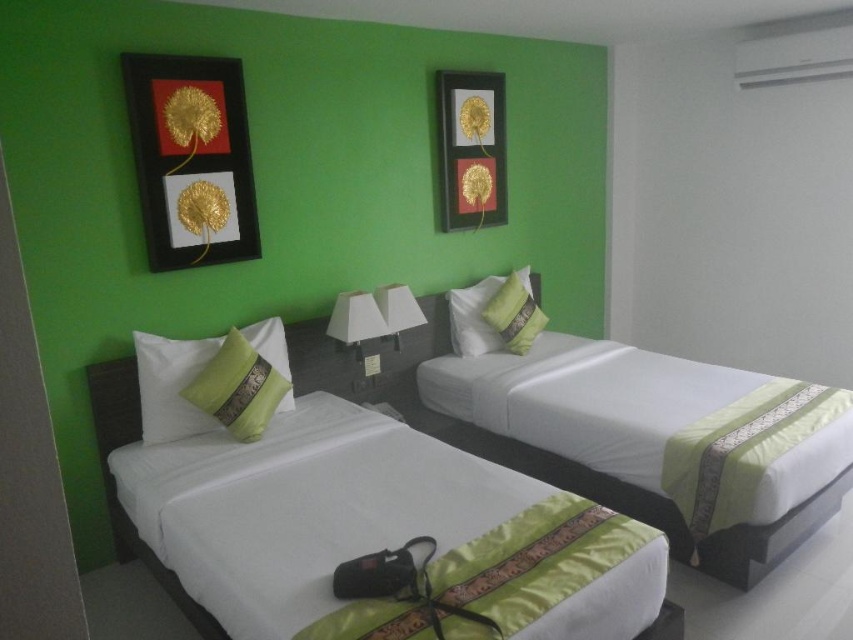
You are standing at the entrance of the hotel room and want to move towards the white satin bed at center. There is a satin white bed at center in the way. Which bed should you move around to reach your destination?

The satin white bed at center is behind the white satin bed at center, so you should move around the white satin bed at center to reach it.

You are a hotel housekeeper who needs to ensure that the white satin bed at center and the green satin pillow at center are positioned correctly according to the hotel standards. The standard requires that the distance between them should be exactly 30 inches. Based on the image, is the current distance within the acceptable range?

The distance between the white satin bed at center and the green satin pillow at center is 29.90 inches, which is just 0.10 inches less than the required 30 inches. This slight discrepancy may be considered within acceptable tolerance depending on the hotel standards, but strictly speaking, it does not meet the exact requirement.